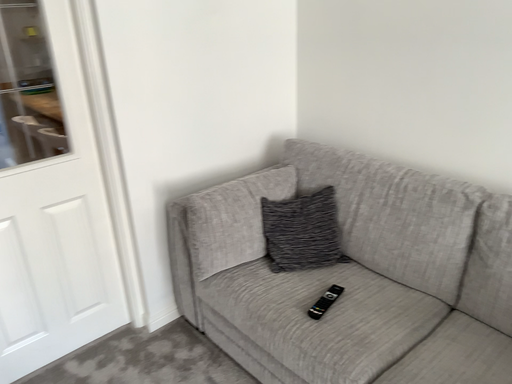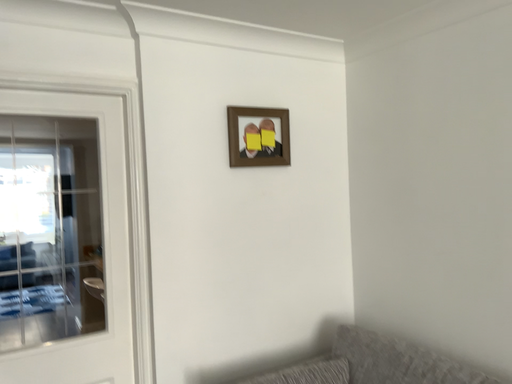
Question: Which way did the camera rotate in the video?

Choices:
 (A) rotated right
 (B) rotated left

Answer: (B)